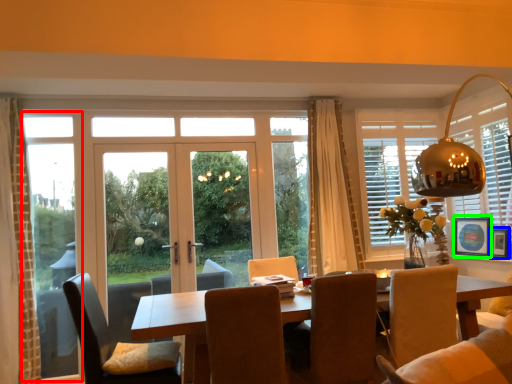
Question: Which object is positioned closest to window frame (highlighted by a red box)? Select from picture frame (highlighted by a blue box) and picture frame (highlighted by a green box).

Choices:
 (A) picture frame
 (B) picture frame

Answer: (B)